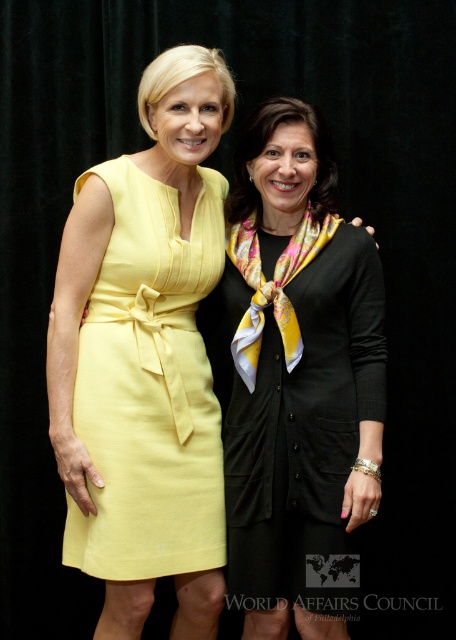
Based on the scene description, where is the black silk dress at center located in terms of its 2D coordinates?

The black silk dress at center is located at the 2D coordinates of point (295, 380).

You are a fashion designer who needs to decide which dress to feature in your upcoming collection. Based on the image, which dress has a larger size between the black silk dress at center and the linen yellow dress at left?

The black silk dress at center is larger in size than the linen yellow dress at left, so it should be chosen for the collection if a larger size is preferred.

You are a fashion designer observing two dresses in the image. The black silk dress at center and the linen yellow dress at left. Which dress is taller in height?

The black silk dress at center has a greater height compared to the linen yellow dress at left.